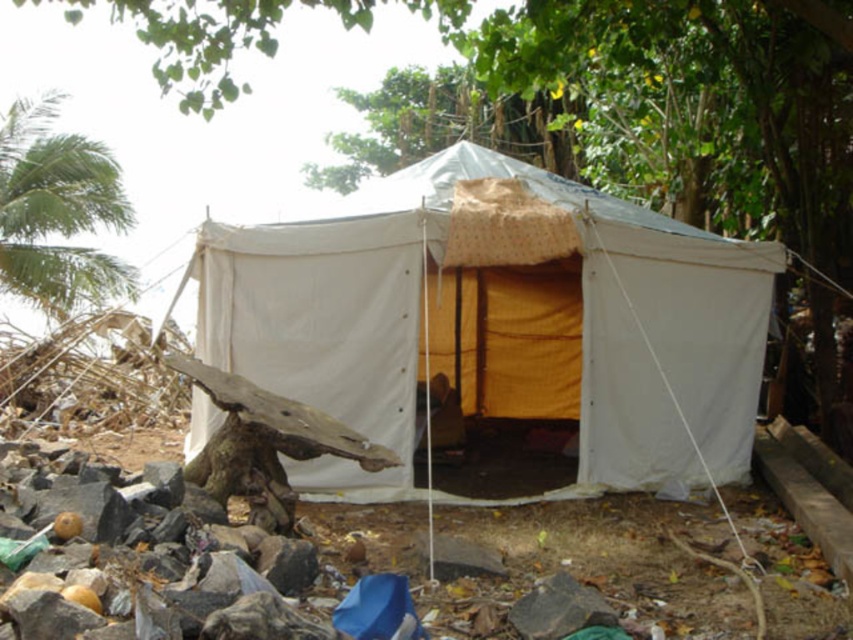
Question: Is white canvas tent at center wider than green leafy tree at left?

Choices:
 (A) yes
 (B) no

Answer: (B)

Question: Which point is closer to the camera?

Choices:
 (A) (526, 54)
 (B) (96, 195)
 (C) (572, 394)

Answer: (A)

Question: Based on their relative distances, which object is farther from the white canvas tent at center?

Choices:
 (A) green leafy tree at left
 (B) green leafy tree at upper center

Answer: (A)

Question: Does white canvas tent at center have a lesser width compared to green leafy tree at left?

Choices:
 (A) no
 (B) yes

Answer: (B)

Question: Which point is farther from the camera taking this photo?

Choices:
 (A) (616, 420)
 (B) (4, 252)

Answer: (B)

Question: Can you confirm if white canvas tent at center is smaller than green leafy tree at upper center?

Choices:
 (A) no
 (B) yes

Answer: (B)